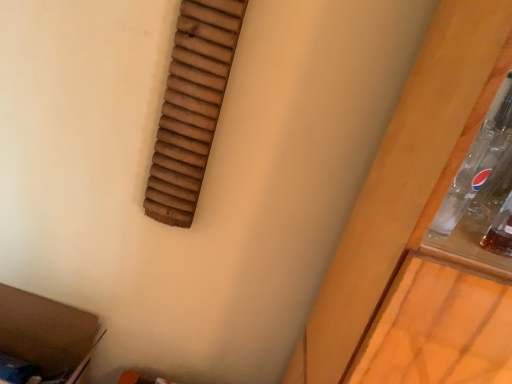
Question: Relative to wooden slats at upper left, is brown cardboard at lower left in front or behind?

Choices:
 (A) behind
 (B) front

Answer: (A)

Question: In terms of height, does brown cardboard at lower left look taller or shorter compared to wooden slats at upper left?

Choices:
 (A) tall
 (B) short

Answer: (B)

Question: Visually, is brown cardboard at lower left positioned to the left or to the right of wooden slats at upper left?

Choices:
 (A) right
 (B) left

Answer: (B)

Question: Would you say wooden slats at upper left is inside or outside brown cardboard at lower left?

Choices:
 (A) inside
 (B) outside

Answer: (B)

Question: Is wooden slats at upper left taller or shorter than brown cardboard at lower left?

Choices:
 (A) short
 (B) tall

Answer: (B)

Question: Would you say wooden slats at upper left is to the left or to the right of brown cardboard at lower left in the picture?

Choices:
 (A) right
 (B) left

Answer: (A)

Question: Is wooden slats at upper left in front of or behind brown cardboard at lower left in the image?

Choices:
 (A) front
 (B) behind

Answer: (A)